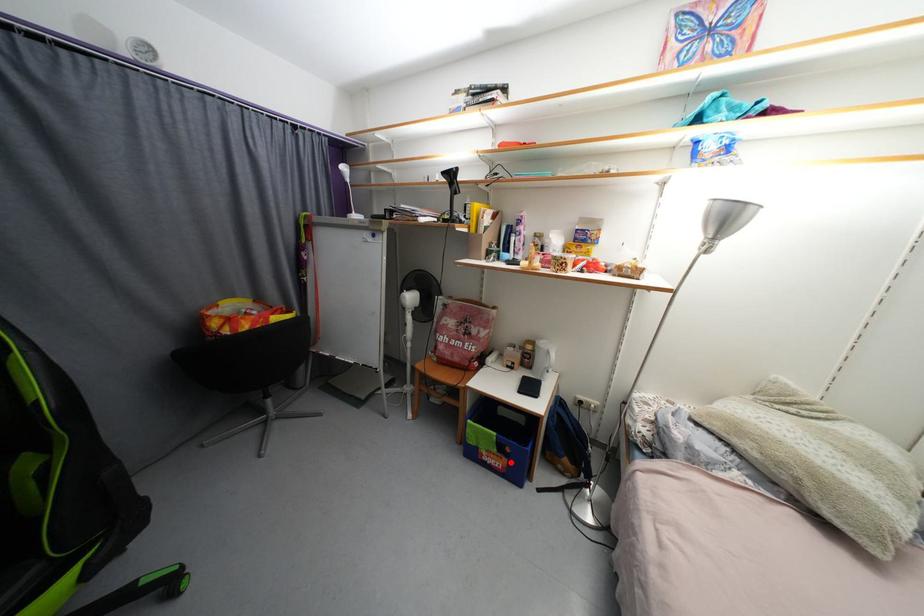
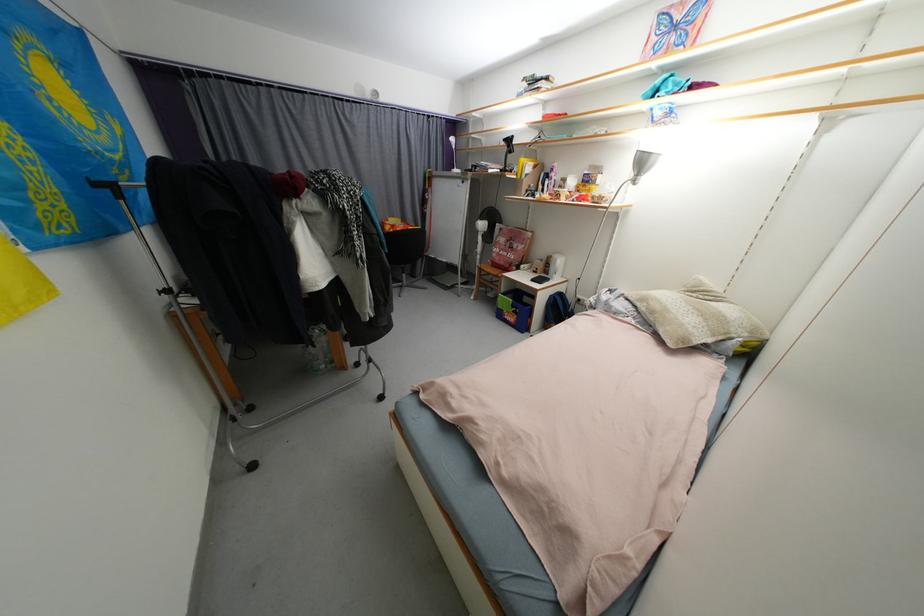
Find the pixel in the second image that matches the highlighted location in the first image.

(520, 318)